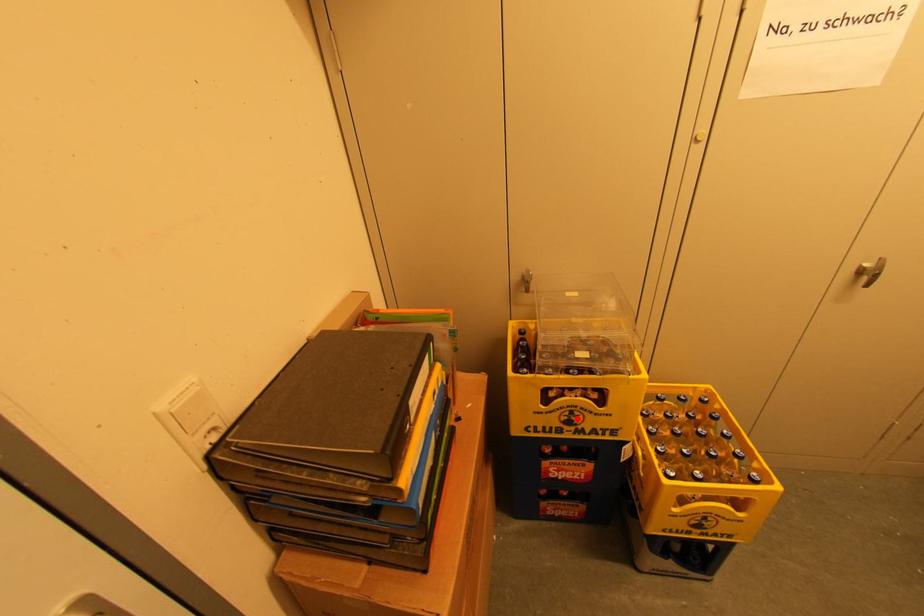
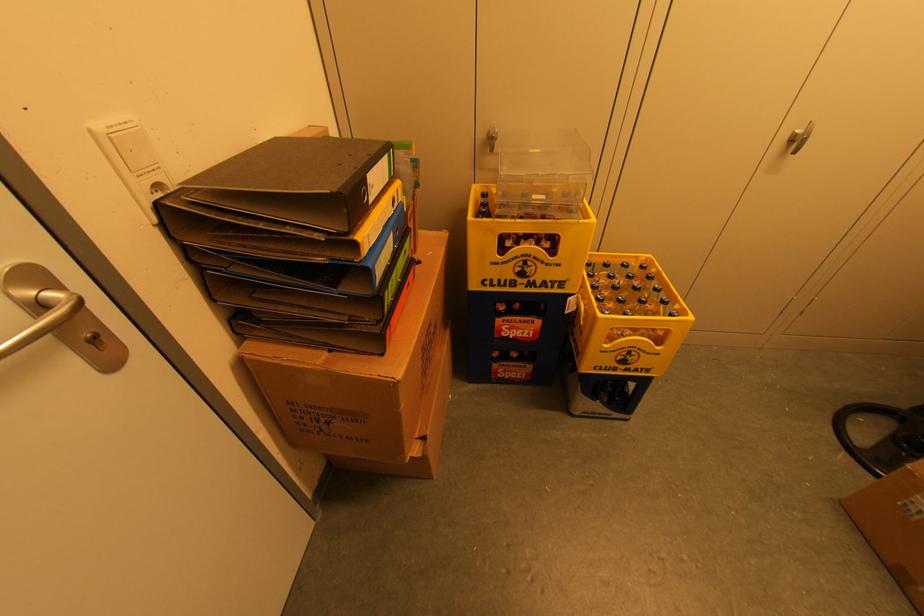
Question: A red point is marked in image1. In image2, is the corresponding 3D point closer to the camera or farther? Reply with the corresponding letter.

Choices:
 (A) The corresponding 3D point is closer.
 (B) The corresponding 3D point is farther.

Answer: (A)